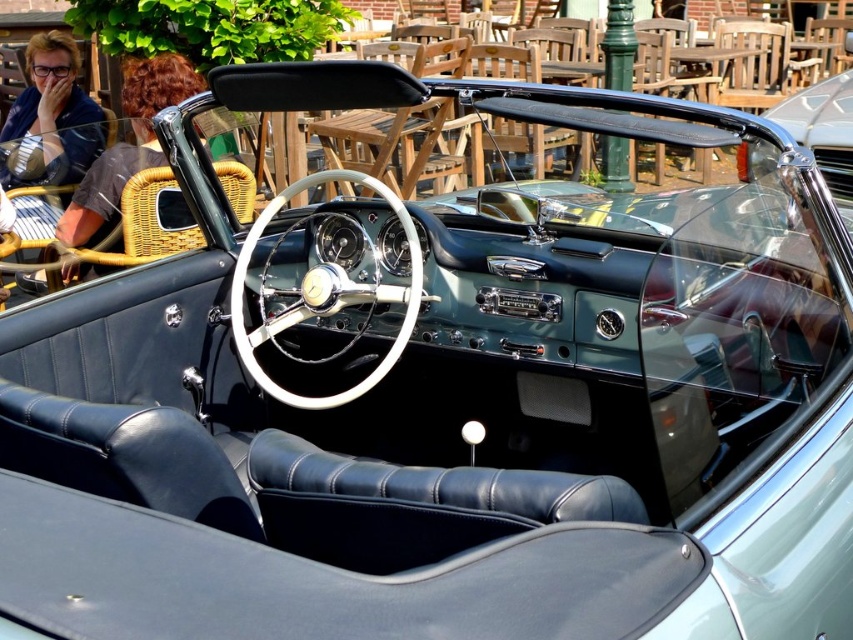
You are sitting in the driver seat of the classic convertible car. You need to adjust the rearview mirror which is positioned at point 0.227, 0.150. Is the shiny silver steering wheel at center in the way of adjusting the mirror?

The shiny silver steering wheel at center is located at point (126, 145), which is the same position as the rearview mirror. Therefore, the steering wheel is directly in the way of adjusting the mirror.